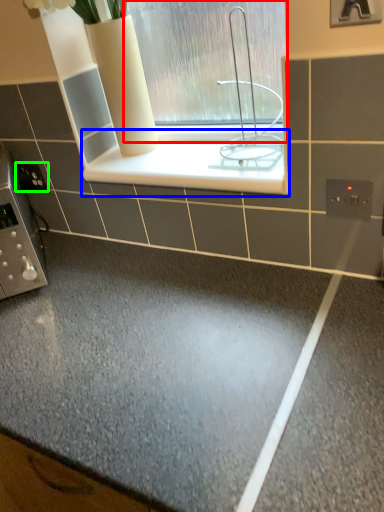
Question: Based on their relative distances, which object is nearer to window (highlighted by a red box)? Choose from ledge (highlighted by a blue box) and electric outlet (highlighted by a green box).

Choices:
 (A) ledge
 (B) electric outlet

Answer: (A)